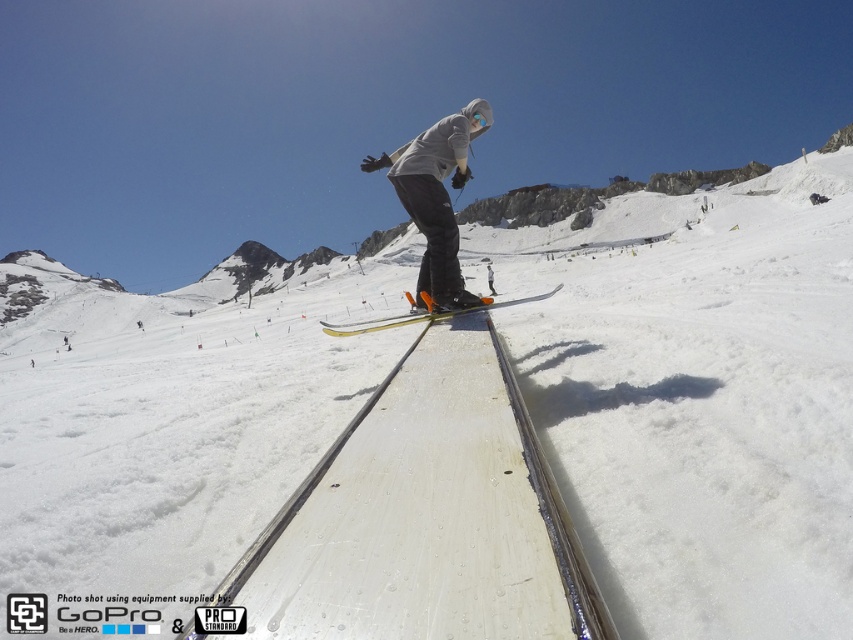
You are a photographer capturing the skier midair. You need to focus your camera on the white matte snowboarder at center and the yellow metallic skis at center. Which object should you adjust your focus to first if you want to capture the one closer to the camera?

The white matte snowboarder at center is to the left of yellow metallic skis at center, but since they are both at center, their distance from the camera might be similar. However, the description does not specify depth, so focus on both equally.

You are a photographer standing at the base of the mountain slope. You want to capture the skier midair between the two points, point (418,138) and point (357,333). Which point should you focus on first to ensure the skier is in the frame?

Point (418,138) is further to the camera than point (357,333), so you should focus on point (418,138) first to ensure the skier is in the frame as they approach from further away.

You are a drone operator trying to capture the perfect shot of the white matte snowboarder at center. The drone is currently at position coordinates of 0.45, 0.65. What direction should you move the drone to get closer to the snowboarder?

The white matte snowboarder at center is located at coordinates (x=436, y=195). The drone is at (x=554, y=288). To move closer, the drone should move southwest, decreasing both the x and y coordinates to align with the snowboarder.